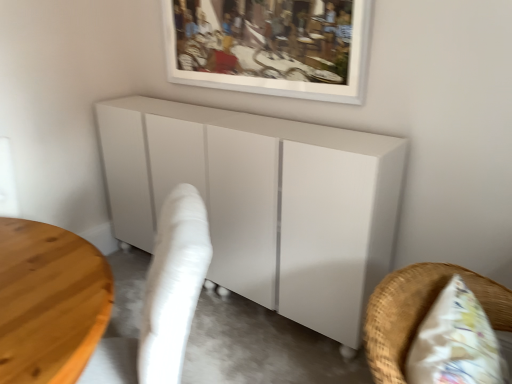
Question: Would you say white glossy cabinet at center, the 1th furniture positioned from the back, is outside white wicker chair at lower right, positioned as the 2th furniture in back-to-front order?

Choices:
 (A) no
 (B) yes

Answer: (B)

Question: Is white glossy cabinet at center, the 1th furniture positioned from the back, facing towards white wicker chair at lower right, the first furniture from the front?

Choices:
 (A) yes
 (B) no

Answer: (B)

Question: Does white glossy cabinet at center, the 1th furniture positioned from the back, have a lesser width compared to white wicker chair at lower right, the first furniture from the front?

Choices:
 (A) no
 (B) yes

Answer: (A)

Question: From the image's perspective, is white glossy cabinet at center, the 1th furniture positioned from the back, beneath white wicker chair at lower right, positioned as the 2th furniture in back-to-front order?

Choices:
 (A) yes
 (B) no

Answer: (B)

Question: From a real-world perspective, is white glossy cabinet at center, which ranks as the 2th furniture in front-to-back order, beneath white wicker chair at lower right, the first furniture from the front?

Choices:
 (A) no
 (B) yes

Answer: (B)

Question: Could white wicker chair at lower right, the first furniture from the front, be considered to be inside white glossy cabinet at center, which ranks as the 2th furniture in front-to-back order?

Choices:
 (A) yes
 (B) no

Answer: (B)

Question: Considering the relative sizes of white fabric swivel chair at lower left and white glossy cabinet at center, the 1th furniture positioned from the back, in the image provided, is white fabric swivel chair at lower left bigger than white glossy cabinet at center, the 1th furniture positioned from the back,?

Choices:
 (A) no
 (B) yes

Answer: (A)

Question: Is white fabric swivel chair at lower left far from white glossy cabinet at center, which ranks as the 2th furniture in front-to-back order?

Choices:
 (A) yes
 (B) no

Answer: (B)

Question: Are white fabric swivel chair at lower left and white glossy cabinet at center, which ranks as the 2th furniture in front-to-back order, making contact?

Choices:
 (A) no
 (B) yes

Answer: (A)

Question: Is white fabric swivel chair at lower left not within white glossy cabinet at center, the 1th furniture positioned from the back?

Choices:
 (A) no
 (B) yes

Answer: (B)

Question: Is the depth of white fabric swivel chair at lower left less than that of white glossy cabinet at center, the 1th furniture positioned from the back?

Choices:
 (A) no
 (B) yes

Answer: (B)

Question: Is white fabric swivel chair at lower left thinner than white glossy cabinet at center, the 1th furniture positioned from the back?

Choices:
 (A) no
 (B) yes

Answer: (A)

Question: Does white fabric swivel chair at lower left come in front of white wicker chair at lower right, the first furniture from the front?

Choices:
 (A) yes
 (B) no

Answer: (B)